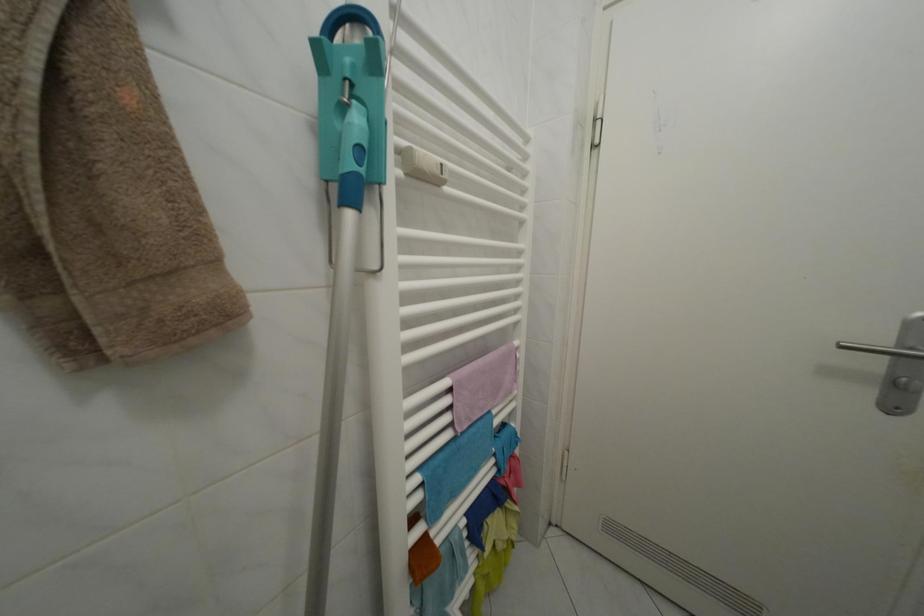
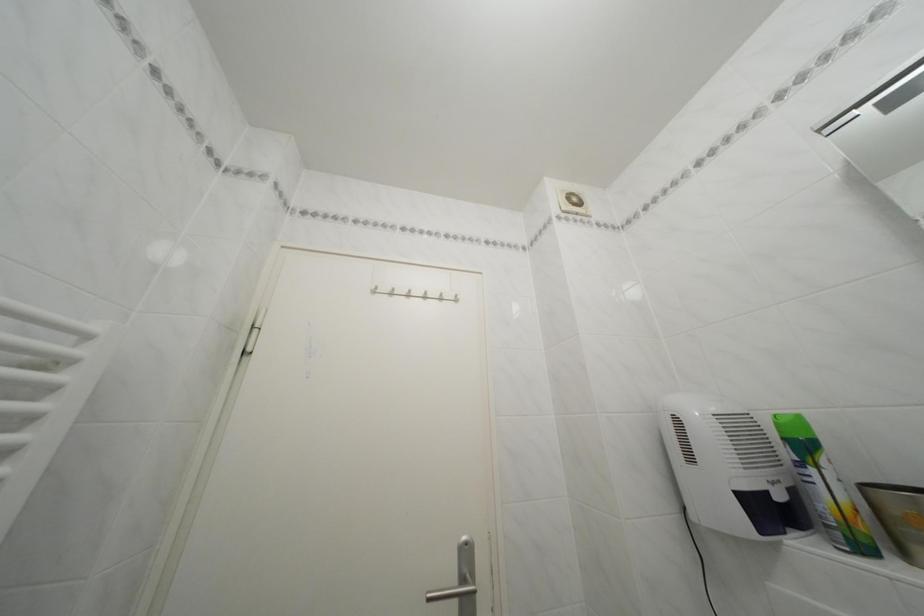
Based on the continuous images, in which direction is the camera rotating?

The camera rotated toward right-up.